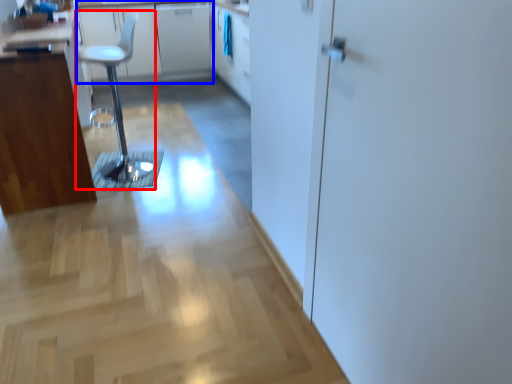
Question: Which object is further to the camera taking this photo, step stool (highlighted by a red box) or counter top (highlighted by a blue box)?

Choices:
 (A) step stool
 (B) counter top

Answer: (B)